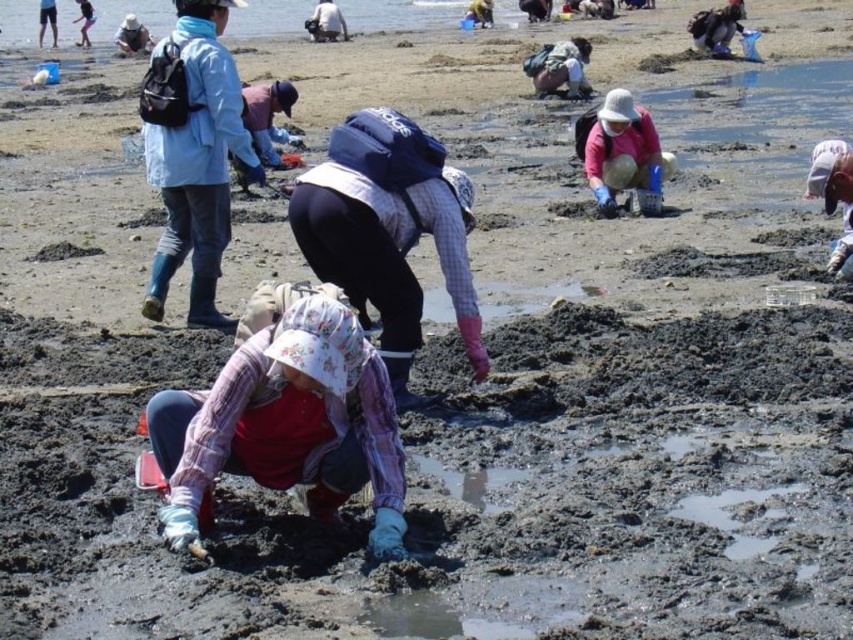
Is point (289, 369) in front of point (181, 227)?

Yes.

Which of these two, plaid fabric hat at center or light blue fabric jacket at upper left, stands taller?

With more height is light blue fabric jacket at upper left.

Between point (167, 509) and point (193, 285), which one is positioned behind?

Point (193, 285)

Locate an element on the screen. The image size is (853, 640). plaid fabric hat at center is located at coordinates (288, 424).

Who is shorter, plaid fabric hat at center or plaid fabric shirt at center?

plaid fabric hat at center

Does point (341, 493) come closer to viewer compared to point (320, 164)?

Yes, it is.

Where is `plaid fabric hat at center`? The height and width of the screenshot is (640, 853). plaid fabric hat at center is located at coordinates (288, 424).

Can you confirm if plaid fabric shirt at center is positioned above light blue fabric jacket at upper left?

Incorrect, plaid fabric shirt at center is not positioned above light blue fabric jacket at upper left.

Measure the distance from plaid fabric shirt at center to light blue fabric jacket at upper left.

The distance of plaid fabric shirt at center from light blue fabric jacket at upper left is 2.84 meters.

Measure the distance between point (331, 140) and camera.

Point (331, 140) is 8.29 meters from camera.

Locate an element on the screen. plaid fabric shirt at center is located at coordinates (387, 230).